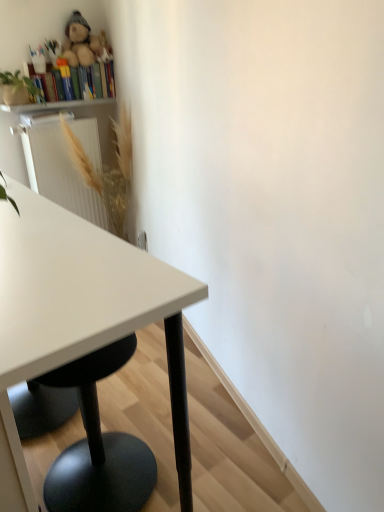
Image resolution: width=384 pixels, height=512 pixels. What do you see at coordinates (57, 105) in the screenshot?
I see `wooden bookshelf at upper left` at bounding box center [57, 105].

This screenshot has width=384, height=512. What do you see at coordinates (19, 89) in the screenshot? I see `green matte plant at upper left` at bounding box center [19, 89].

What do you see at coordinates (82, 308) in the screenshot?
I see `white glossy table at left` at bounding box center [82, 308].

Looking at this image, measure the distance between point [113,68] and camera.

3.07 meters.

Describe the element at coordinates (95, 80) in the screenshot. I see `multicolored cardboard books at upper left` at that location.

This screenshot has height=512, width=384. I want to click on wooden bookshelf at upper left, so [x=57, y=105].

Which of these two, white glossy table at left or multicolored cardboard books at upper left, is smaller?

multicolored cardboard books at upper left.

Is white glossy table at left positioned far away from multicolored cardboard books at upper left?

Absolutely, white glossy table at left is distant from multicolored cardboard books at upper left.

Is point (185, 478) closer or farther from the camera than point (31, 72)?

Point (185, 478) is positioned closer to the camera compared to point (31, 72).

Would you consider wooden bookshelf at upper left to be distant from white glossy table at left?

Yes, wooden bookshelf at upper left and white glossy table at left are quite far apart.

Between wooden bookshelf at upper left and white glossy table at left, which one has less height?

With less height is wooden bookshelf at upper left.

What's the angular difference between wooden bookshelf at upper left and white glossy table at left's facing directions?

They differ by 89.7 degrees in their facing directions.

Could you tell me if wooden bookshelf at upper left is turned towards white glossy table at left?

No.

Can you tell me how much fluffy plush bear at upper left and white glossy table at left differ in facing direction?

They differ by 91.3 degrees in their facing directions.

Between fluffy plush bear at upper left and white glossy table at left, which one appears on the right side from the viewer's perspective?

white glossy table at left.

From the picture: Is fluffy plush bear at upper left far from white glossy table at left?

Yes, fluffy plush bear at upper left and white glossy table at left are located far from each other.

Is fluffy plush bear at upper left bigger or smaller than white glossy table at left?

fluffy plush bear at upper left is smaller than white glossy table at left.

Is fluffy plush bear at upper left not near wooden bookshelf at upper left?

They are positioned close to each other.

Is fluffy plush bear at upper left closer to camera compared to wooden bookshelf at upper left?

That is True.

From the image's perspective, which one is positioned lower, fluffy plush bear at upper left or wooden bookshelf at upper left?

wooden bookshelf at upper left is shown below in the image.

At what (x,y) coordinates should I click in order to perform the action: click on shelf behind the fluffy plush bear at upper left. Please return your answer as a coordinate pair (x, y). Image resolution: width=384 pixels, height=512 pixels. Looking at the image, I should click on (57, 105).

Between point (42, 100) and point (100, 89), which one is positioned in front?

The point (42, 100) is closer to the camera.

Between green matte plant at upper left and multicolored cardboard books at upper left, which one is positioned behind?

Positioned behind is multicolored cardboard books at upper left.

From the picture: In the image, is green matte plant at upper left on the left side or the right side of multicolored cardboard books at upper left?

green matte plant at upper left is positioned on multicolored cardboard books at upper left's left side.

Would you say green matte plant at upper left is outside multicolored cardboard books at upper left?

Yes, green matte plant at upper left is located beyond the bounds of multicolored cardboard books at upper left.

Consider the image. Can you confirm if green matte plant at upper left is wider than white glossy table at left?

In fact, green matte plant at upper left might be narrower than white glossy table at left.

Looking at this image, would you say green matte plant at upper left is to the left or to the right of white glossy table at left in the picture?

green matte plant at upper left is positioned on white glossy table at left's left side.

The height and width of the screenshot is (512, 384). In order to click on plant that is above the white glossy table at left (from the image's perspective) in this screenshot , I will do `click(19, 89)`.

What's the angular difference between green matte plant at upper left and white glossy table at left's facing directions?

The facing directions of green matte plant at upper left and white glossy table at left are 90 degrees apart.

Considering the relative sizes of green matte plant at upper left and fluffy plush bear at upper left in the image provided, is green matte plant at upper left bigger than fluffy plush bear at upper left?

Yes, green matte plant at upper left is bigger than fluffy plush bear at upper left.

Find the location of a particular element. This screenshot has width=384, height=512. toy on the right of green matte plant at upper left is located at coordinates (83, 42).

Considering the relative sizes of green matte plant at upper left and fluffy plush bear at upper left in the image provided, is green matte plant at upper left taller than fluffy plush bear at upper left?

In fact, green matte plant at upper left may be shorter than fluffy plush bear at upper left.

Considering the points (16, 70) and (72, 15), which point is behind, point (16, 70) or point (72, 15)?

The point (72, 15) is behind.

You are a GUI agent. You are given a task and a screenshot of the screen. Output one action in this format:
    pyautogui.click(x=<x>, y=<y>)
    Task: Click on the bookshelf above the white glossy table at left (from a real-world perspective)
    This screenshot has width=384, height=512.
    Given the screenshot: What is the action you would take?
    pyautogui.click(x=95, y=80)

Identify the location of shelf behind the white glossy table at left. This screenshot has height=512, width=384. (57, 105).

Based on their spatial positions, is fluffy plush bear at upper left or green matte plant at upper left further from multicolored cardboard books at upper left?

The object further to multicolored cardboard books at upper left is green matte plant at upper left.

Considering their positions, is multicolored cardboard books at upper left positioned further to wooden bookshelf at upper left than fluffy plush bear at upper left?

Among the two, fluffy plush bear at upper left is located further to wooden bookshelf at upper left.

Which object lies further to the anchor point white glossy table at left, golden textured plant at upper left or wooden bookshelf at upper left?

wooden bookshelf at upper left is further to white glossy table at left.

Considering their positions, is multicolored cardboard books at upper left positioned closer to fluffy plush bear at upper left than golden textured plant at upper left?

The object closer to fluffy plush bear at upper left is multicolored cardboard books at upper left.

When comparing their distances from wooden bookshelf at upper left, does golden textured plant at upper left or green matte plant at upper left seem closer?

green matte plant at upper left is closer to wooden bookshelf at upper left.

When comparing their distances from fluffy plush bear at upper left, does green matte plant at upper left or white glossy table at left seem further?

Based on the image, white glossy table at left appears to be further to fluffy plush bear at upper left.

From the image, which object appears to be farther from wooden bookshelf at upper left, white glossy table at left or green matte plant at upper left?

white glossy table at left.

Estimate the real-world distances between objects in this image. Which object is further from green matte plant at upper left, wooden bookshelf at upper left or golden textured plant at upper left?

golden textured plant at upper left.

Find the location of a particular element. shelf located between green matte plant at upper left and multicolored cardboard books at upper left in the depth direction is located at coordinates (57, 105).

Where is `bookshelf between fluffy plush bear at upper left and wooden bookshelf at upper left in the up-down direction`? The height and width of the screenshot is (512, 384). bookshelf between fluffy plush bear at upper left and wooden bookshelf at upper left in the up-down direction is located at coordinates (95, 80).

Identify the location of plant located between white glossy table at left and wooden bookshelf at upper left in the depth direction. The image size is (384, 512). (19, 89).

You are a GUI agent. You are given a task and a screenshot of the screen. Output one action in this format:
    pyautogui.click(x=<x>, y=<y>)
    Task: Click on the plant between multicolored cardboard books at upper left and golden textured plant at upper left from top to bottom
    
    Given the screenshot: What is the action you would take?
    pyautogui.click(x=19, y=89)